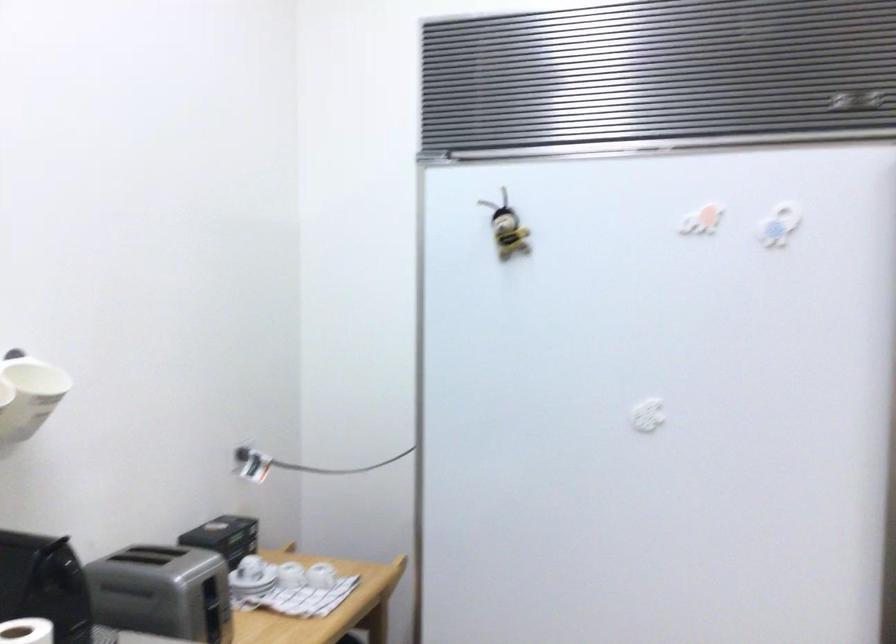
Find where to lift the paper towel roll. Please return your answer as a coordinate pair (x, y).

(26, 630)